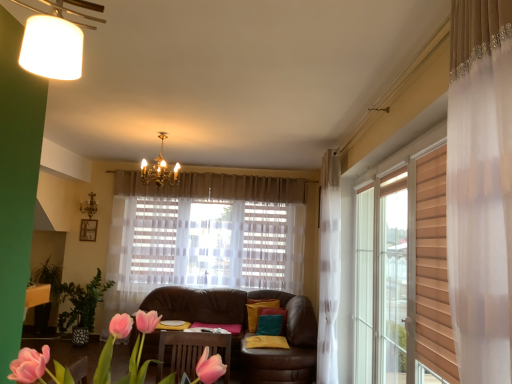
Question: Considering the relative sizes of brown leather couch at center and pink fabric flowers at lower left in the image provided, is brown leather couch at center bigger than pink fabric flowers at lower left?

Choices:
 (A) no
 (B) yes

Answer: (A)

Question: From a real-world perspective, is brown leather couch at center physically above pink fabric flowers at lower left?

Choices:
 (A) yes
 (B) no

Answer: (B)

Question: Does brown leather couch at center have a greater height compared to pink fabric flowers at lower left?

Choices:
 (A) no
 (B) yes

Answer: (B)

Question: From the image's perspective, is brown leather couch at center below pink fabric flowers at lower left?

Choices:
 (A) yes
 (B) no

Answer: (A)

Question: Considering the relative sizes of brown leather couch at center and pink fabric flowers at lower left in the image provided, is brown leather couch at center wider than pink fabric flowers at lower left?

Choices:
 (A) yes
 (B) no

Answer: (B)

Question: From a real-world perspective, is brown leather couch at center below pink fabric flowers at lower left?

Choices:
 (A) no
 (B) yes

Answer: (B)

Question: Does pink fabric flowers at lower left appear on the left side of brown leather couch at center?

Choices:
 (A) yes
 (B) no

Answer: (A)

Question: Is pink fabric flowers at lower left oriented away from brown leather couch at center?

Choices:
 (A) yes
 (B) no

Answer: (B)

Question: From the image's perspective, is pink fabric flowers at lower left under brown leather couch at center?

Choices:
 (A) no
 (B) yes

Answer: (A)

Question: Are pink fabric flowers at lower left and brown leather couch at center making contact?

Choices:
 (A) yes
 (B) no

Answer: (B)

Question: Is pink fabric flowers at lower left to the right of brown leather couch at center from the viewer's perspective?

Choices:
 (A) yes
 (B) no

Answer: (B)

Question: Is the depth of pink fabric flowers at lower left greater than that of brown leather couch at center?

Choices:
 (A) yes
 (B) no

Answer: (B)

Question: Based on their positions, is brown leather couch at center located to the left or right of pink fabric flowers at lower left?

Choices:
 (A) left
 (B) right

Answer: (B)